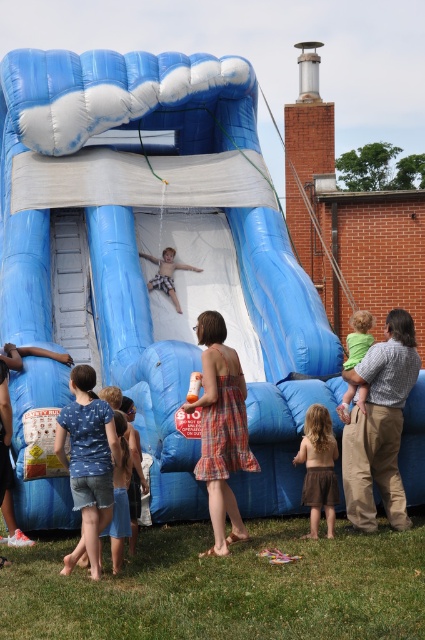
Is green fabric at center positioned at the back of matte black shorts at lower left?

Yes, it is.

Does green fabric at center have a greater height compared to matte black shorts at lower left?

Incorrect, green fabric at center's height is not larger of matte black shorts at lower left's.

Does point (365, 310) come behind point (5, 358)?

Yes, it is.

Locate an element on the screen. green fabric at center is located at coordinates 359,337.

In the scene shown: Between plaid dress at center and matte blue shorts at center, which one is positioned lower?

Positioned lower is plaid dress at center.

Can you confirm if plaid dress at center is wider than matte blue shorts at center?

Correct, the width of plaid dress at center exceeds that of matte blue shorts at center.

Between point (227, 497) and point (167, 269), which one is positioned behind?

Point (167, 269)

This screenshot has width=425, height=640. I want to click on plaid dress at center, so click(221, 429).

Who is positioned more to the right, denim shorts at lower left or brown skirt at lower center?

Positioned to the right is brown skirt at lower center.

Is point (102, 435) positioned before point (334, 458)?

Yes, it is.

Who is more distant from viewer, (x=62, y=426) or (x=333, y=483)?

The point (x=333, y=483) is behind.

This screenshot has height=640, width=425. Find the location of `denim shorts at lower left`. denim shorts at lower left is located at coordinates pos(87,461).